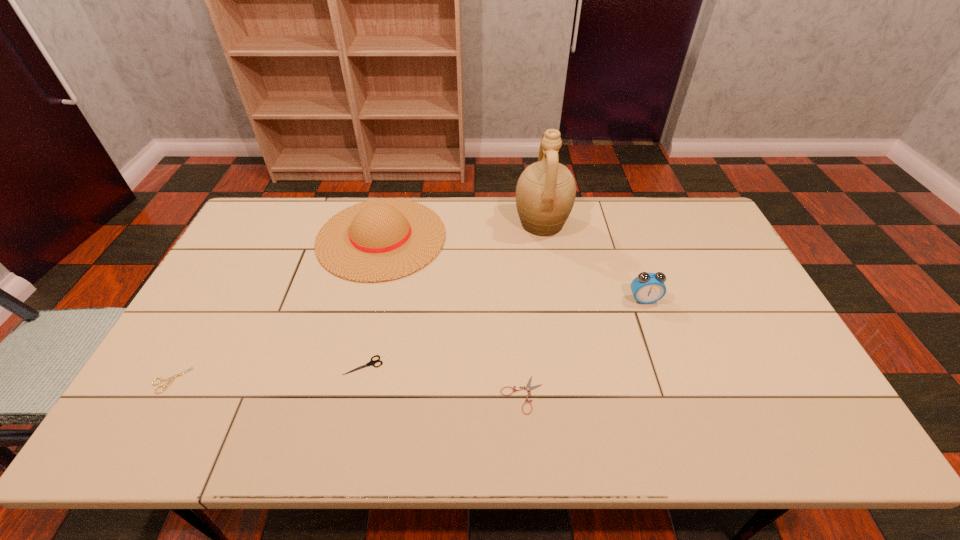
Find the location of a particular element. Image resolution: width=960 pixels, height=540 pixels. the tallest object is located at coordinates (546, 190).

Locate an element on the screen. bonnet is located at coordinates (380, 240).

This screenshot has height=540, width=960. Identify the location of the rightmost object. (647, 288).

This screenshot has height=540, width=960. Identify the location of the third farthest object. (647, 288).

At what (x,y) coordinates should I click in order to perform the action: click on the tallest shears. Please return your answer as a coordinate pair (x, y). The width and height of the screenshot is (960, 540). Looking at the image, I should click on (372, 362).

At what (x,y) coordinates should I click in order to perform the action: click on the fourth tallest object. Please return your answer as a coordinate pair (x, y). Looking at the image, I should click on (372, 362).

This screenshot has width=960, height=540. I want to click on the leftmost shears, so click(171, 379).

You are a GUI agent. You are given a task and a screenshot of the screen. Output one action in this format:
    pyautogui.click(x=<x>, y=<y>)
    Task: Click on the second shortest object
    
    Given the screenshot: What is the action you would take?
    (x=171, y=379)

The width and height of the screenshot is (960, 540). I want to click on the shortest shears, so click(x=528, y=388).

Find the location of a particular element. the shortest object is located at coordinates (528, 388).